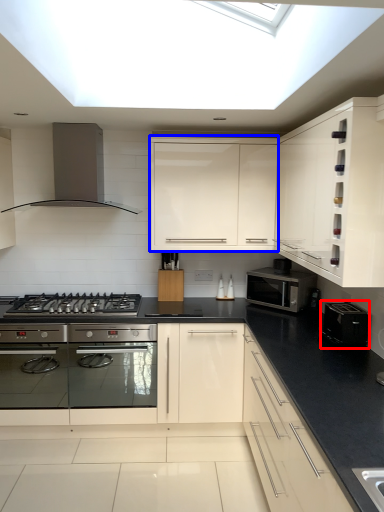
Question: Which of the following is the closest to the observer, appliance (highlighted by a red box) or cabinetry (highlighted by a blue box)?

Choices:
 (A) appliance
 (B) cabinetry

Answer: (A)